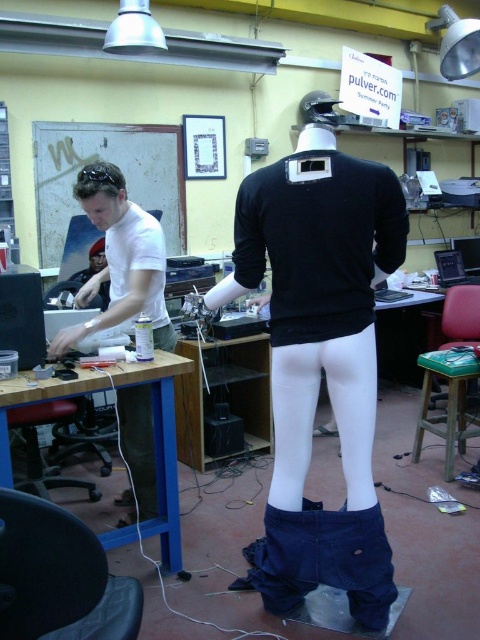
Can you confirm if white matte shirt at left is bigger than green fabric stool at lower right?

Actually, white matte shirt at left might be smaller than green fabric stool at lower right.

Is white matte shirt at left above green fabric stool at lower right?

Indeed, white matte shirt at left is positioned over green fabric stool at lower right.

Is point (123, 289) behind point (423, 424)?

That is False.

You are a GUI agent. You are given a task and a screenshot of the screen. Output one action in this format:
    pyautogui.click(x=<x>, y=<y>)
    Task: Click on the white matte shirt at left
    
    Given the screenshot: What is the action you would take?
    pyautogui.click(x=120, y=260)

Is black matte shirt at center thinner than white matte shirt at left?

No.

Is black matte shirt at center wider than white matte shirt at left?

Yes, black matte shirt at center is wider than white matte shirt at left.

Where is `black matte shirt at center`? This screenshot has height=640, width=480. black matte shirt at center is located at coordinates (321, 355).

Looking at this image, can you confirm if black matte shirt at center is shorter than green fabric stool at lower right?

No, black matte shirt at center is not shorter than green fabric stool at lower right.

Is black matte shirt at center positioned behind green fabric stool at lower right?

No, it is not.

Which is behind, point (274, 275) or point (445, 355)?

The point (445, 355) is more distant.

This screenshot has height=640, width=480. Identify the location of black matte shirt at center. (321, 355).